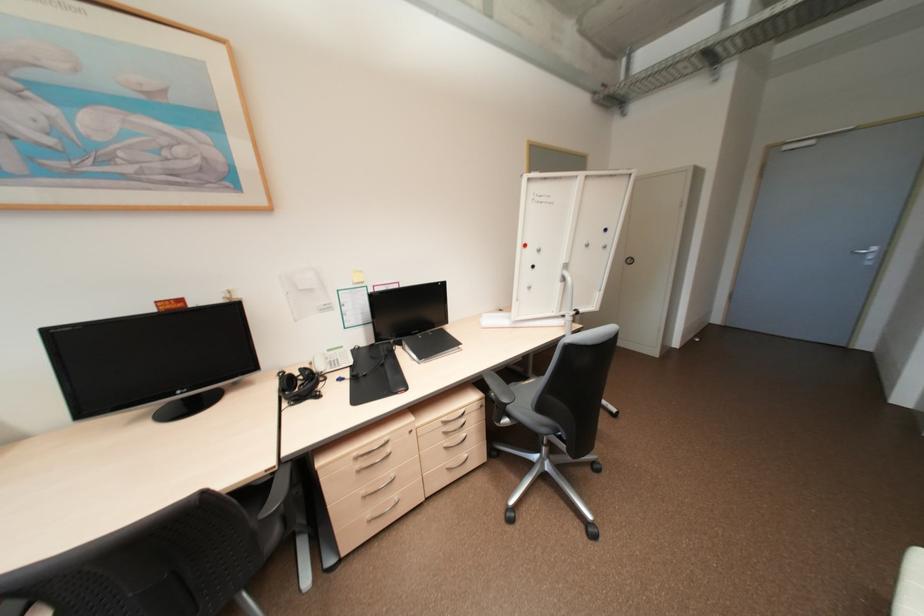
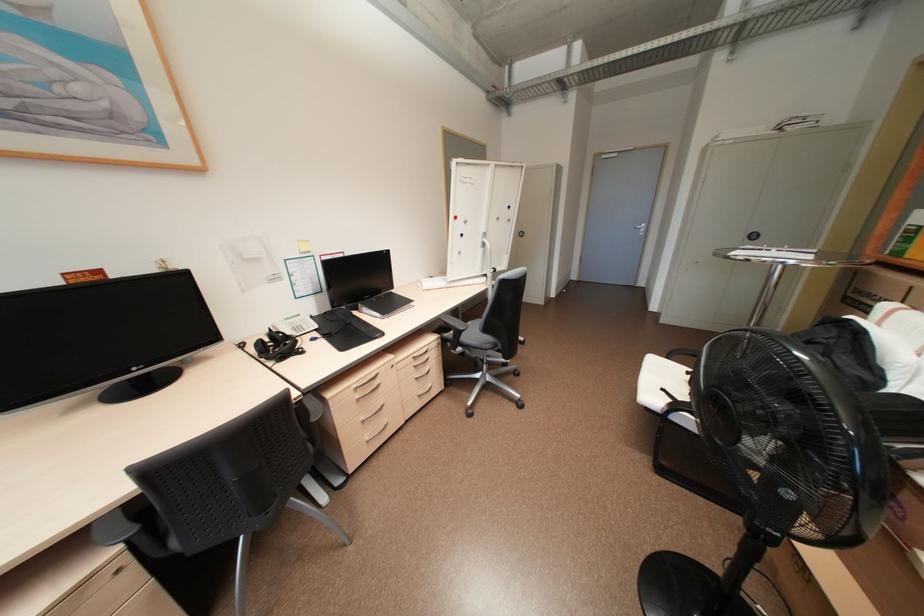
Where in the second image is the point corresponding to the point at 400,286 from the first image?

(346, 256)